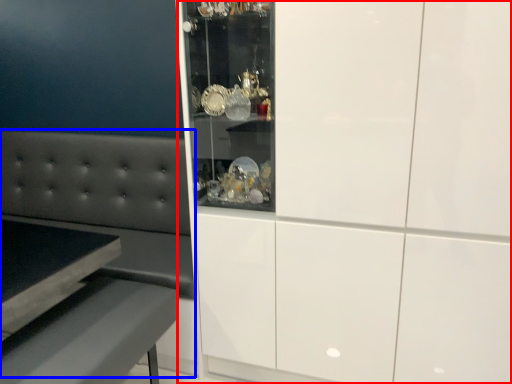
Question: Which of the following is the farthest to the observer, cabinetry (highlighted by a red box) or couch (highlighted by a blue box)?

Choices:
 (A) cabinetry
 (B) couch

Answer: (B)